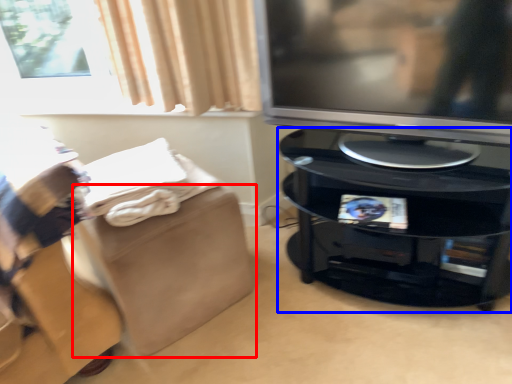
Question: Which of the following is the closest to the observer, footrest (highlighted by a red box) or furniture (highlighted by a blue box)?

Choices:
 (A) footrest
 (B) furniture

Answer: (B)